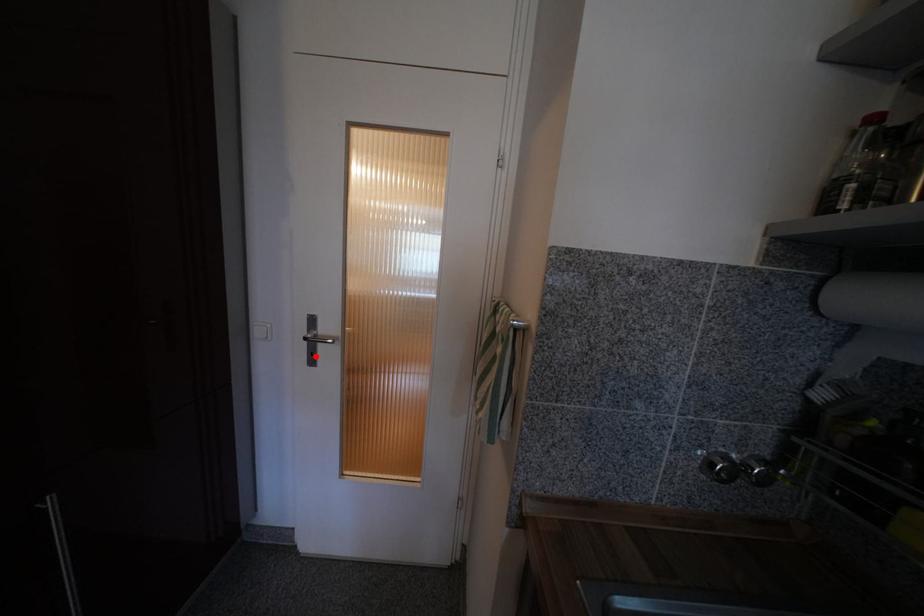
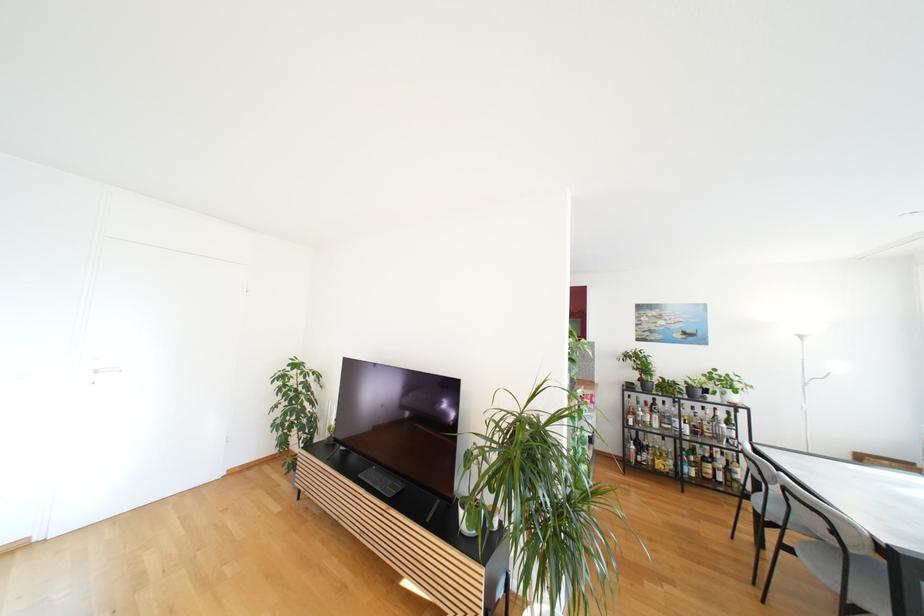
Question: I am providing you with two images of the same scene from different viewpoints. A red point is marked on the first image. Can you still see the location of the red point in image 2?

Choices:
 (A) Yes
 (B) No

Answer: (B)